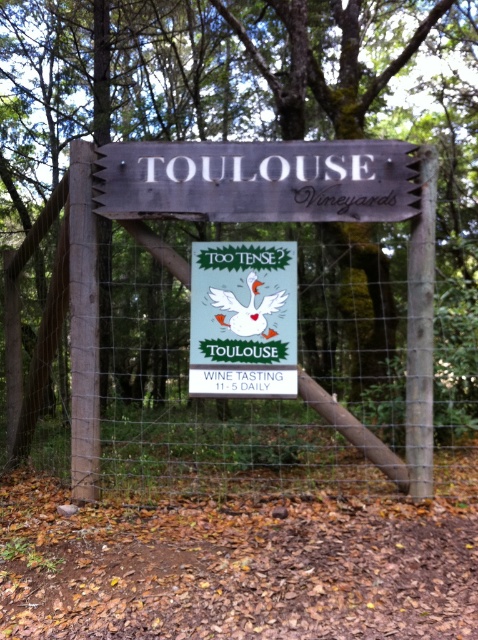
Does wooden fence at center appear over matte green sign at center?

No.

Does point (109, 145) come closer to viewer compared to point (241, 291)?

No, (109, 145) is behind (241, 291).

Image resolution: width=478 pixels, height=640 pixels. In order to click on wooden fence at center in this screenshot , I will do `click(241, 324)`.

This screenshot has height=640, width=478. What do you see at coordinates (241, 324) in the screenshot?
I see `wooden fence at center` at bounding box center [241, 324].

How much distance is there between wooden fence at center and wooden signboard at center?

They are 2.45 meters apart.

Based on the photo, who is more forward, (238, 188) or (315, 145)?

Positioned in front is point (238, 188).

This screenshot has height=640, width=478. Identify the location of wooden fence at center. (241, 324).

Who is shorter, wooden signboard at center or matte green sign at center?

wooden signboard at center is shorter.

Who is higher up, wooden signboard at center or matte green sign at center?

Positioned higher is wooden signboard at center.

The width and height of the screenshot is (478, 640). I want to click on wooden signboard at center, so click(x=258, y=180).